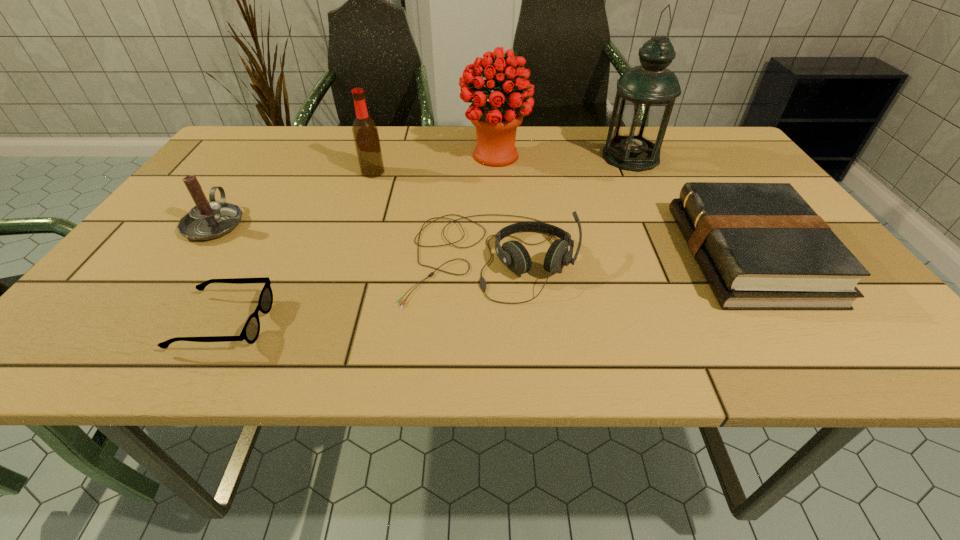
Identify the location of vacant space at the near left corner of the desktop. (139, 334).

In the image, there is a desktop. At what (x,y) coordinates should I click in order to perform the action: click on vacant space at the near right corner. Please return your answer as a coordinate pair (x, y). This screenshot has height=540, width=960. Looking at the image, I should click on (855, 363).

This screenshot has width=960, height=540. I want to click on blank region between the oil lamp and the leftmost object, so click(x=422, y=190).

The width and height of the screenshot is (960, 540). Identify the location of vacant region between the hardback book and the fifth shortest object. (561, 214).

I want to click on free point between the spectacles and the second tallest object, so click(x=360, y=239).

Locate an element on the screen. This screenshot has width=960, height=540. free space between the headset and the leftmost object is located at coordinates (352, 240).

Identify the location of vacant area that lies between the fourth tallest object and the tallest object. The height and width of the screenshot is (540, 960). (422, 190).

Where is `vacant space that is in between the bouquet and the candle`? The image size is (960, 540). vacant space that is in between the bouquet and the candle is located at coordinates (355, 190).

Where is `free space between the candle and the headset`? free space between the candle and the headset is located at coordinates (352, 240).

The height and width of the screenshot is (540, 960). I want to click on free space between the tallest object and the sixth object from right to left, so click(427, 240).